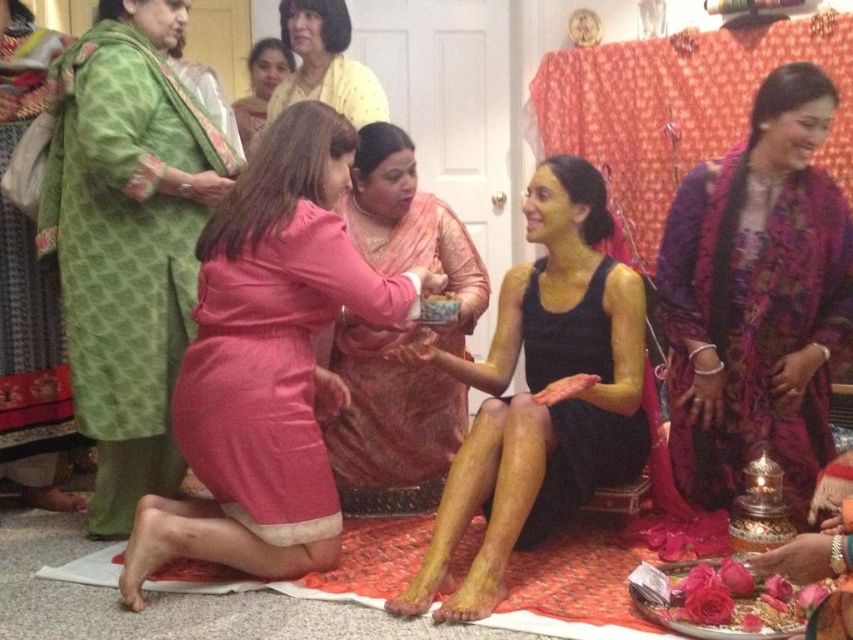
You are an anthropologist observing this cultural ceremony. You notice the green textured robe at upper left and the purple silk saree at upper right. Which one is positioned higher up in the image?

The green textured robe at upper left is positioned higher up in the image than the purple silk saree at upper right.

You are a photographer at the event and want to capture a clear photo of the pink satin dress at center without the purple silk saree at upper right blocking it. Based on their positions, is this possible?

The pink satin dress at center is in front of the purple silk saree at upper right, so yes, the photographer can capture a clear photo of the pink satin dress at center without the purple silk saree at upper right blocking it since it is already positioned in front.

You are a photographer setting up for a cultural event. You need to position a light source between the pink satin dress at center and the purple silk saree at upper right. Based on their widths, which side should the light be placed closer to for optimal illumination?

The pink satin dress at center might be wider than purple silk saree at upper right, so placing the light closer to the pink satin dress at center would ensure better coverage and illumination.